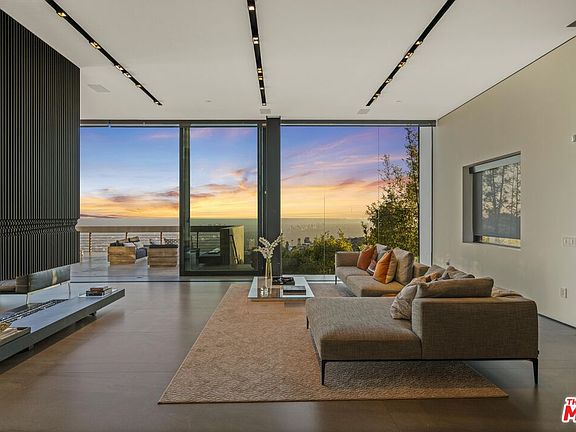
This screenshot has width=576, height=432. What are the coordinates of `light strips in ceiling` in the screenshot? It's located at (106, 54), (257, 46), (426, 32).